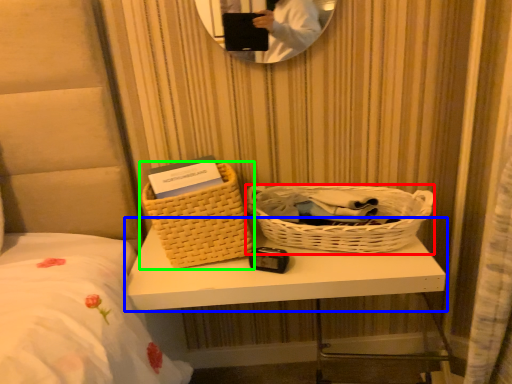
Question: Based on their relative distances, which object is nearer to picnic basket (highlighted by a red box)? Choose from table (highlighted by a blue box) and picnic basket (highlighted by a green box).

Choices:
 (A) table
 (B) picnic basket

Answer: (A)